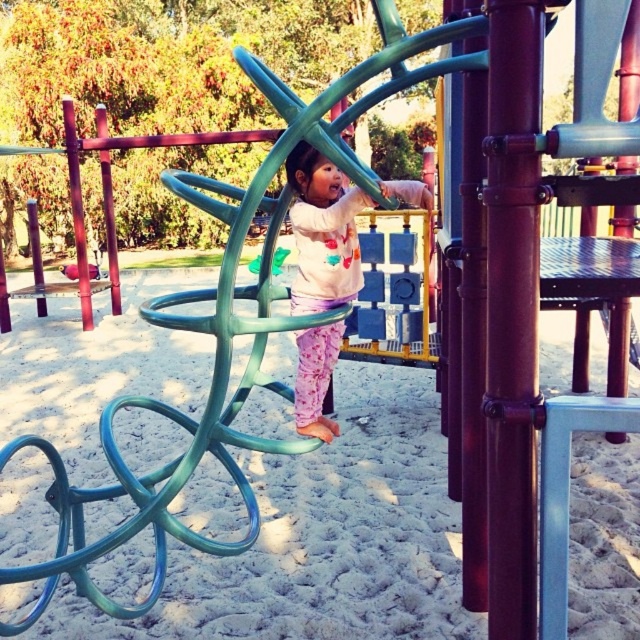
Is point (438, 564) behind point (301, 352)?

No, (438, 564) is in front of (301, 352).

Is white sand at center taller than pastel pink fabric pants at center?

Incorrect, white sand at center's height is not larger of pastel pink fabric pants at center's.

Where is `white sand at center`? white sand at center is located at coordinates (321, 538).